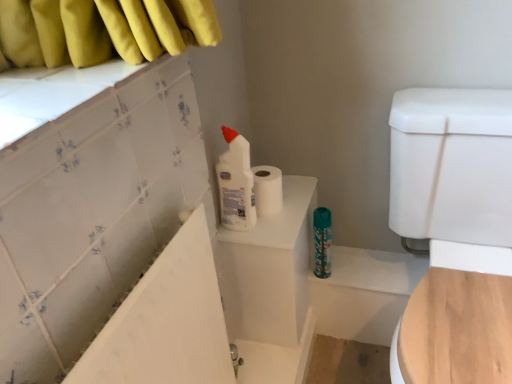
Identify the location of spots to the right of white plastic bottle at upper center. This screenshot has height=384, width=512. (286, 217).